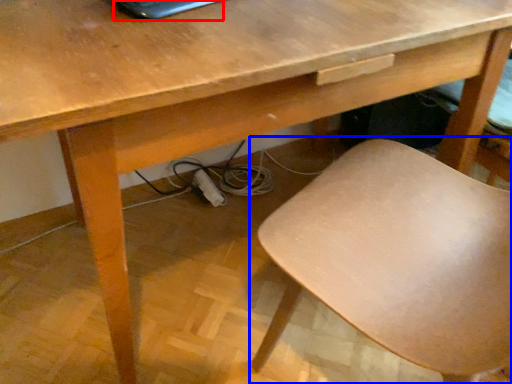
Question: Which point is further to the camera, laptop (highlighted by a red box) or chair (highlighted by a blue box)?

Choices:
 (A) laptop
 (B) chair

Answer: (A)